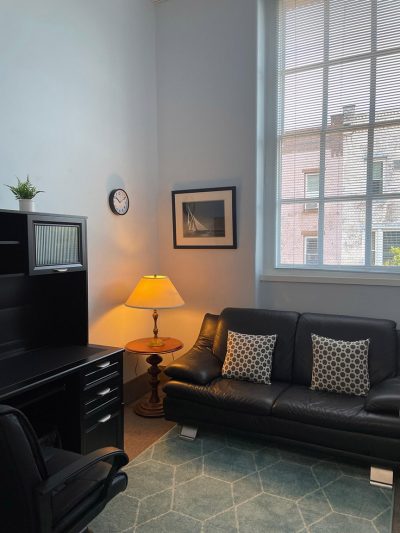
The image size is (400, 533). Identify the location of corner. (160, 161).